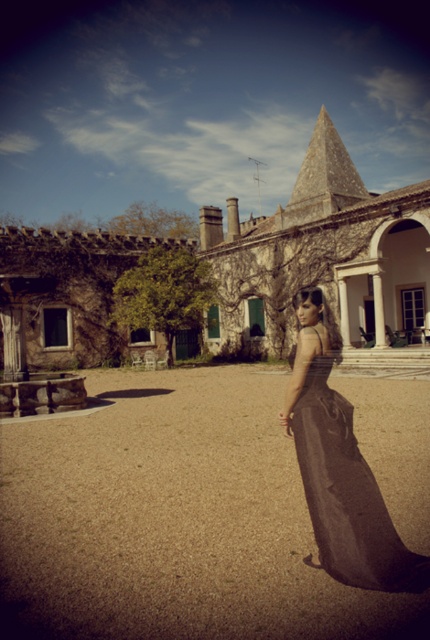
You are a photographer planning to capture the brown gravel at center and the matte black dress at center in a single shot. Based on the scene description, which object should you focus on first to ensure both are in sharp focus?

The brown gravel at center is bigger than the matte black dress at center, so focusing on the brown gravel at center first would help ensure both are in sharp focus since it is larger and likely closer to the camera.

You are a delivery person carrying a package that requires a flat surface to place. You see the brown gravel at center and the matte black dress at center in the courtyard. Which surface would be more suitable for placing the package?

The matte black dress at center is not a surface, so the brown gravel at center is the only option available. However, the gravel might not provide a stable surface. Since the question asks for suitability based on the given options, the answer should focus on the available surfaces. The answer should state that the brown gravel at center is the only surface available, but it may not be ideal due to its texture. However, according to the objects description, the distance between them is 11.70 feet, which is

You are a photographer setting up a shoot in this courtyard. You want to ensure that the matte black dress at center is visible against the background. Considering the brown gravel at center, which is under the dress, what adjustment could you make to the lighting to enhance the contrast between the dress and the gravel?

Since the brown gravel at center is positioned under the matte black dress at center, adjusting the lighting to create a spotlight effect on the dress would help it stand out against the darker gravel background.